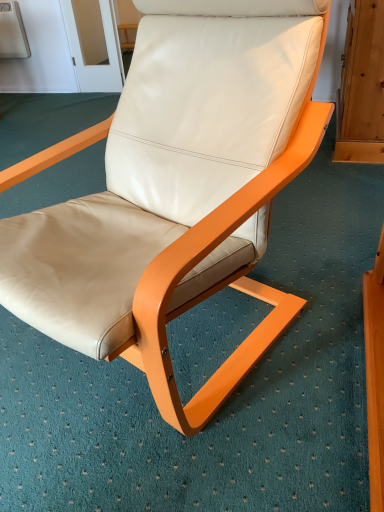
Identify the location of matte white leather chair at center. The image size is (384, 512). (176, 191).

What do you see at coordinates (176, 191) in the screenshot?
I see `matte white leather chair at center` at bounding box center [176, 191].

Locate an element on the screen. This screenshot has height=512, width=384. matte white leather chair at center is located at coordinates (176, 191).